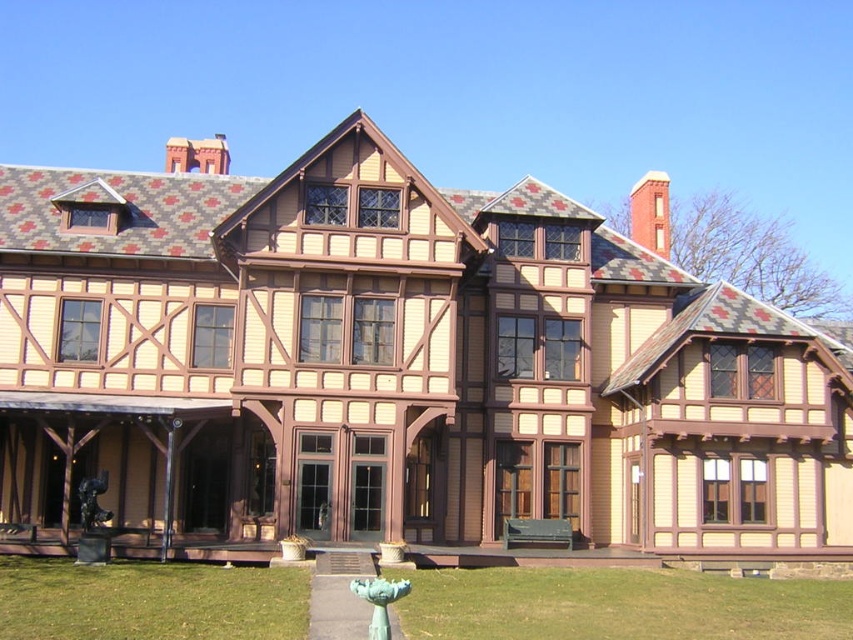
Does green grass at lower left appear under brown wood porch at center?

No.

Based on the photo, which is below, green grass at lower left or brown wood porch at center?

Positioned lower is brown wood porch at center.

Image resolution: width=853 pixels, height=640 pixels. Describe the element at coordinates (149, 600) in the screenshot. I see `green grass at lower left` at that location.

Where is `green grass at lower left`? green grass at lower left is located at coordinates (149, 600).

Looking at this image, who is more distant from viewer, [833,616] or [47,616]?

The point [833,616] is behind.

Is point (693, 612) behind point (86, 566)?

No.

Who is more distant from viewer, [688,624] or [285,584]?

The point [285,584] is more distant.

You are a GUI agent. You are given a task and a screenshot of the screen. Output one action in this format:
    pyautogui.click(x=<x>, y=<y>)
    Task: Click on the green grass at lower center
    Image resolution: width=853 pixels, height=640 pixels.
    Given the screenshot: What is the action you would take?
    pyautogui.click(x=618, y=605)

Is point (787, 602) in front of point (494, 563)?

Yes, point (787, 602) is closer to viewer.

Is green grass at lower center closer to camera compared to brown wood porch at center?

Yes, green grass at lower center is in front of brown wood porch at center.

The width and height of the screenshot is (853, 640). What do you see at coordinates (618, 605) in the screenshot? I see `green grass at lower center` at bounding box center [618, 605].

At what (x,y) coordinates should I click in order to perform the action: click on green grass at lower center. Please return your answer as a coordinate pair (x, y). The height and width of the screenshot is (640, 853). Looking at the image, I should click on (618, 605).